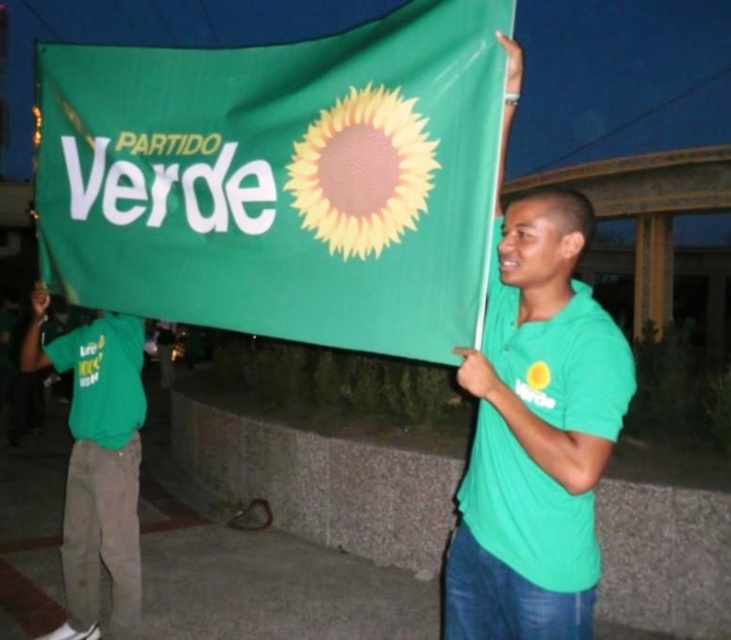
In the scene shown: Is green matte shirt at center smaller than green cotton shirt at left?

Correct, green matte shirt at center occupies less space than green cotton shirt at left.

Is point (493, 458) closer to viewer compared to point (137, 339)?

Yes.

This screenshot has height=640, width=731. Describe the element at coordinates (534, 435) in the screenshot. I see `green matte shirt at center` at that location.

You are a GUI agent. You are given a task and a screenshot of the screen. Output one action in this format:
    pyautogui.click(x=<x>, y=<y>)
    Task: Click on the green matte shirt at center
    This screenshot has height=640, width=731.
    Given the screenshot: What is the action you would take?
    pyautogui.click(x=534, y=435)

Is green fabric flag at center to the right of green cotton shirt at left from the viewer's perspective?

Correct, you'll find green fabric flag at center to the right of green cotton shirt at left.

Between green fabric flag at center and green cotton shirt at left, which one appears on the left side from the viewer's perspective?

From the viewer's perspective, green cotton shirt at left appears more on the left side.

What do you see at coordinates (281, 180) in the screenshot?
I see `green fabric flag at center` at bounding box center [281, 180].

Find the location of a particular element. green fabric flag at center is located at coordinates (281, 180).

Describe the element at coordinates (281, 180) in the screenshot. This screenshot has height=640, width=731. I see `green fabric flag at center` at that location.

Identify the location of green fabric flag at center. (281, 180).